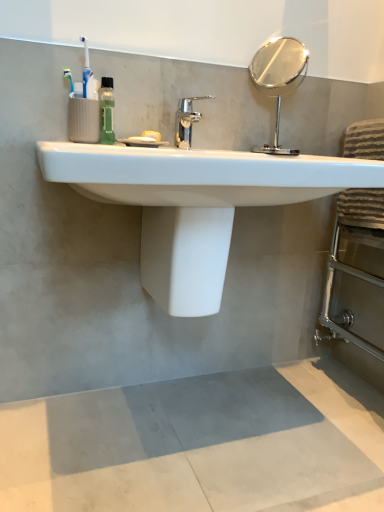
This screenshot has width=384, height=512. Find the location of `free spot above gray concrete mat at lower center (from a real-world perspective)`. free spot above gray concrete mat at lower center (from a real-world perspective) is located at coordinates (229, 434).